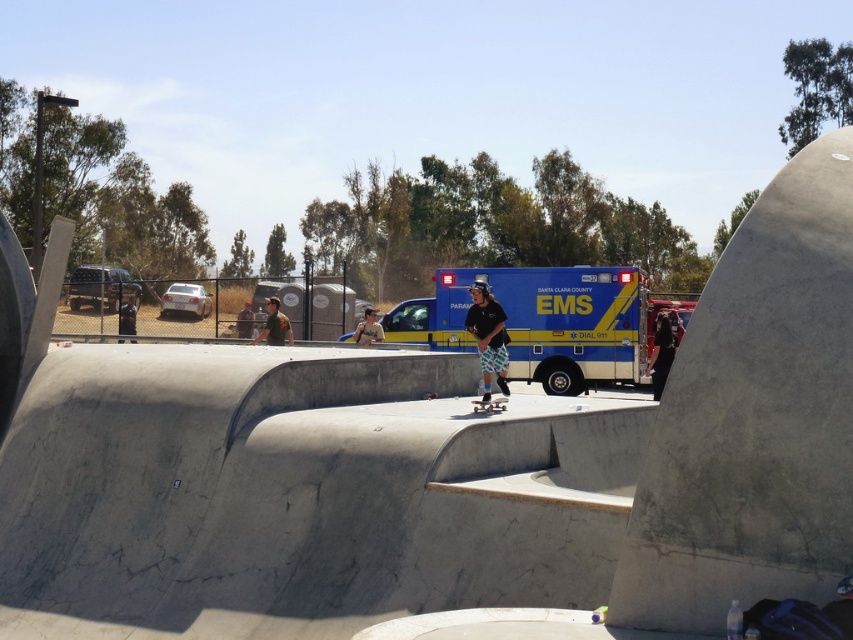
You are standing at the camera position and want to reach the point marked as point (488, 365) in the skatepark. If your walking speed is 3 feet per second, how many seconds will it take you to walk directly to that point?

The distance between the camera and point (488, 365) is 40.95 feet. At a walking speed of 3 feet per second, it will take 40.95 divided by 3, which equals approximately 13.65 seconds to reach the point.

From the picture: You are standing at the skatepark and see two points marked on the ground. One is at point (659, 324) and the other is at point (364, 330). If you want to move from the point closer to the EMS vehicle to the one further away, which point should you start at?

Point (364, 330) is closer to the EMS vehicle, so you should start at point (364, 330) to move towards point (659, 324), which is further away.

You are planning to install a safety net around the skatepark. The safety net must be placed at point 0.5, 0.5. Is the matte black skateboarder at center currently in the area where the safety net will be installed?

The matte black skateboarder at center is located at point (488, 337), which is near but not exactly at the safety net placement point of (426, 320). However, since the skateboarder is at the center area, they might be within the safety net coverage. Further details on the net dimensions are needed to confirm.